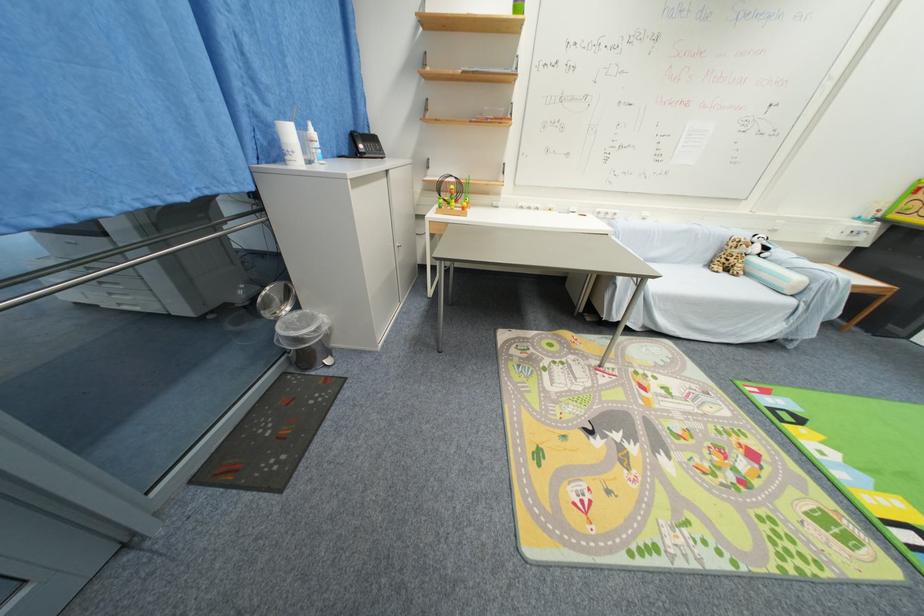
Where is `black telephone handset`? black telephone handset is located at coordinates (367, 145).